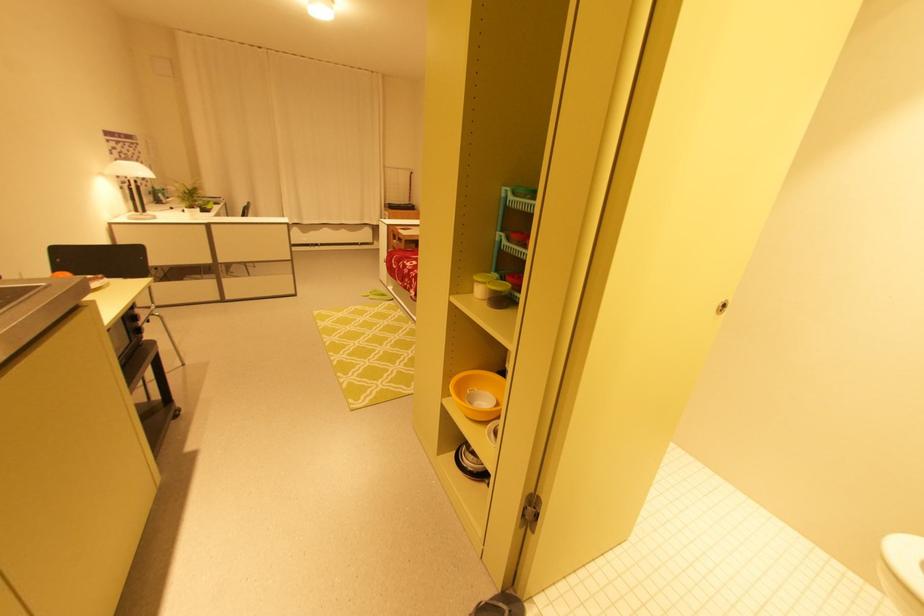
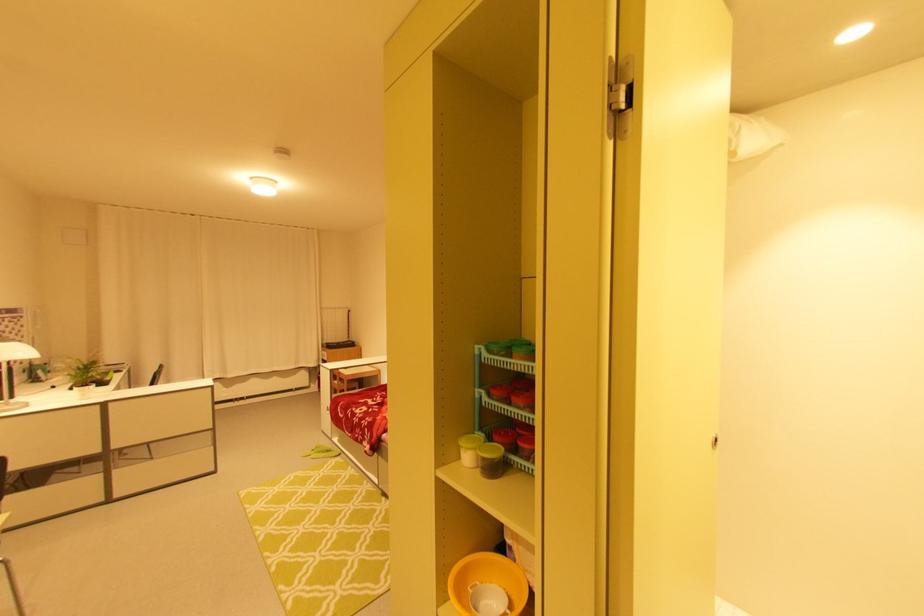
Question: Which direction would the cameraman need to move to produce the second image? Reply with the corresponding letter.

Choices:
 (A) Left
 (B) Right
 (C) Forward
 (D) Backward

Answer: (A)